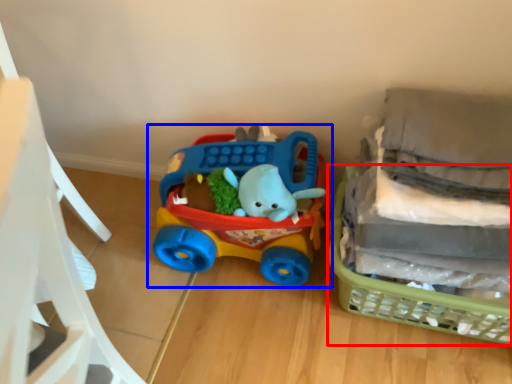
Question: Which object appears closest to the camera in this image, basket (highlighted by a red box) or toy (highlighted by a blue box)?

Choices:
 (A) basket
 (B) toy

Answer: (A)